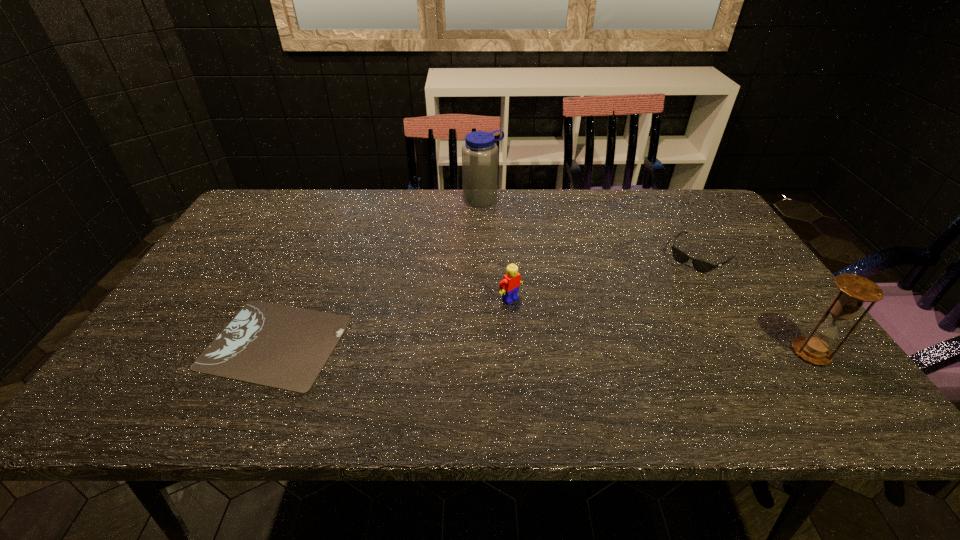
I want to click on hourglass that is at the near edge, so click(x=855, y=290).

I want to click on object located at the left edge, so click(x=284, y=347).

Locate an element on the screen. hourglass present at the right edge is located at coordinates tap(855, 290).

Find the location of `sunglasses that is at the right edge`. sunglasses that is at the right edge is located at coordinates (702, 266).

The image size is (960, 540). What are the coordinates of `object present at the near left corner` in the screenshot? It's located at (284, 347).

The width and height of the screenshot is (960, 540). Find the location of `object that is at the near right corner`. object that is at the near right corner is located at coordinates (855, 290).

The height and width of the screenshot is (540, 960). Identify the location of free space at the far edge of the desktop. (468, 222).

Identify the location of vacant space at the near edge of the desktop. This screenshot has width=960, height=540. (597, 362).

In the image, there is a desktop. Identify the location of vacant space at the left edge. Image resolution: width=960 pixels, height=540 pixels. (207, 270).

At what (x,y) coordinates should I click in order to perform the action: click on free spot at the right edge of the desktop. Please return your answer as a coordinate pair (x, y). This screenshot has height=540, width=960. Looking at the image, I should click on (748, 254).